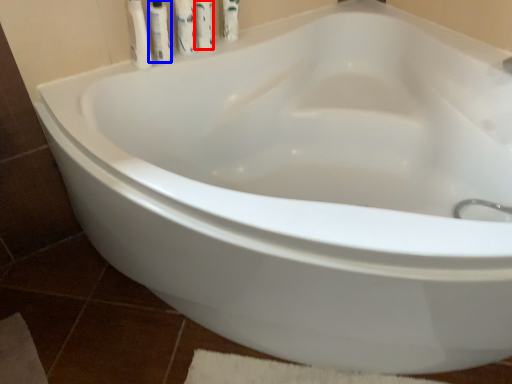
Question: Which of the following is the closest to the observer, cleaning product (highlighted by a red box) or toiletry (highlighted by a blue box)?

Choices:
 (A) cleaning product
 (B) toiletry

Answer: (B)